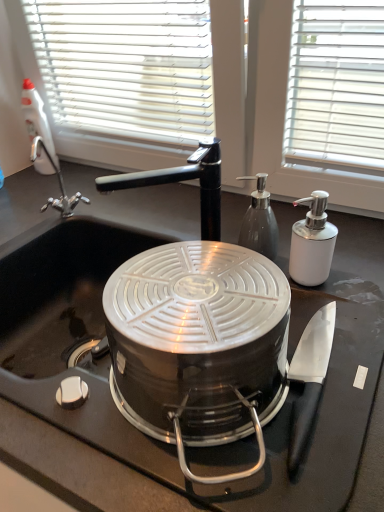
This screenshot has width=384, height=512. Describe the element at coordinates (108, 384) in the screenshot. I see `black matte sink at center` at that location.

What do you see at coordinates (38, 128) in the screenshot? I see `white plastic spray bottle at upper left` at bounding box center [38, 128].

This screenshot has width=384, height=512. Identify the location of white glossy soap dispenser at right, the first kitchen appliance positioned from the right. click(x=312, y=242).

Can we say black matte sink at center lies outside white plastic spray bottle at upper left?

Yes.

From the image's perspective, which is below, black matte sink at center or white plastic spray bottle at upper left?

black matte sink at center is shown below in the image.

Does black matte sink at center have a smaller size compared to white plastic spray bottle at upper left?

No.

What's the angular difference between black matte sink at center and white plastic spray bottle at upper left's facing directions?

The angular difference between black matte sink at center and white plastic spray bottle at upper left is 27.4 degrees.

Is white glossy soap dispenser at right, the first kitchen appliance positioned from the right, positioned with its back to translucent glass soap dispenser at center, the second kitchen appliance viewed from the right?

No, white glossy soap dispenser at right, the first kitchen appliance positioned from the right, is not facing the opposite direction of translucent glass soap dispenser at center, the second kitchen appliance viewed from the right.

From a real-world perspective, is white glossy soap dispenser at right, marked as the second kitchen appliance in a left-to-right arrangement, located higher than translucent glass soap dispenser at center, the 1th kitchen appliance in the left-to-right sequence?

Actually, white glossy soap dispenser at right, marked as the second kitchen appliance in a left-to-right arrangement, is physically below translucent glass soap dispenser at center, the 1th kitchen appliance in the left-to-right sequence, in the real world.

Where is `kitchen appliance on the left side of white glossy soap dispenser at right, marked as the second kitchen appliance in a left-to-right arrangement`? The width and height of the screenshot is (384, 512). kitchen appliance on the left side of white glossy soap dispenser at right, marked as the second kitchen appliance in a left-to-right arrangement is located at coordinates (259, 221).

From a real-world perspective, does white plastic spray bottle at upper left sit lower than translucent glass soap dispenser at center, the second kitchen appliance viewed from the right?

No.

Can you confirm if white plastic spray bottle at upper left is positioned to the left of translucent glass soap dispenser at center, the second kitchen appliance viewed from the right?

Indeed, white plastic spray bottle at upper left is positioned on the left side of translucent glass soap dispenser at center, the second kitchen appliance viewed from the right.

Which is in front, white plastic spray bottle at upper left or translucent glass soap dispenser at center, the 1th kitchen appliance in the left-to-right sequence?

translucent glass soap dispenser at center, the 1th kitchen appliance in the left-to-right sequence, is closer to the camera.

The width and height of the screenshot is (384, 512). In order to click on bottle lying above the translucent glass soap dispenser at center, the 1th kitchen appliance in the left-to-right sequence (from the image's perspective) in this screenshot , I will do `click(38, 128)`.

From the picture: Can you confirm if black matte sink at center is wider than translucent glass soap dispenser at center, the 1th kitchen appliance in the left-to-right sequence?

Yes, black matte sink at center is wider than translucent glass soap dispenser at center, the 1th kitchen appliance in the left-to-right sequence.

Is point (291, 490) more distant than point (252, 228)?

No, (291, 490) is closer to viewer.

This screenshot has height=512, width=384. Identify the location of the 2nd kitchen appliance above when counting from the black matte sink at center (from the image's perspective). click(x=259, y=221).

Does black matte sink at center have a lesser height compared to translucent glass soap dispenser at center, the 1th kitchen appliance in the left-to-right sequence?

In fact, black matte sink at center may be taller than translucent glass soap dispenser at center, the 1th kitchen appliance in the left-to-right sequence.

Which is in front, translucent glass soap dispenser at center, the second kitchen appliance viewed from the right, or white glossy soap dispenser at right, the first kitchen appliance positioned from the right?

Positioned in front is white glossy soap dispenser at right, the first kitchen appliance positioned from the right.

At what (x,y) coordinates should I click in order to perform the action: click on kitchen appliance on the left of white glossy soap dispenser at right, marked as the second kitchen appliance in a left-to-right arrangement. Please return your answer as a coordinate pair (x, y). This screenshot has height=512, width=384. Looking at the image, I should click on (259, 221).

Is translucent glass soap dispenser at center, the second kitchen appliance viewed from the right, to the left of white glossy soap dispenser at right, the first kitchen appliance positioned from the right, from the viewer's perspective?

Yes, translucent glass soap dispenser at center, the second kitchen appliance viewed from the right, is to the left of white glossy soap dispenser at right, the first kitchen appliance positioned from the right.

From a real-world perspective, is translucent glass soap dispenser at center, the 1th kitchen appliance in the left-to-right sequence, physically located above or below white glossy soap dispenser at right, marked as the second kitchen appliance in a left-to-right arrangement?

From a real-world perspective, translucent glass soap dispenser at center, the 1th kitchen appliance in the left-to-right sequence, is physically above white glossy soap dispenser at right, marked as the second kitchen appliance in a left-to-right arrangement.

From the image's perspective, which is below, white plastic spray bottle at upper left or black matte sink at center?

black matte sink at center, from the image's perspective.

What's the angular difference between white plastic spray bottle at upper left and black matte sink at center's facing directions?

The angular difference between white plastic spray bottle at upper left and black matte sink at center is 27.4 degrees.

Is white plastic spray bottle at upper left thinner than black matte sink at center?

Yes.

Based on the photo, is white plastic spray bottle at upper left in contact with black matte sink at center?

They are not placed beside each other.

Does translucent glass soap dispenser at center, the 1th kitchen appliance in the left-to-right sequence, turn towards white plastic spray bottle at upper left?

No.

Does translucent glass soap dispenser at center, the second kitchen appliance viewed from the right, come in front of white plastic spray bottle at upper left?

Yes, translucent glass soap dispenser at center, the second kitchen appliance viewed from the right, is in front of white plastic spray bottle at upper left.

Where is `kitchen appliance that is the 1st one below the white plastic spray bottle at upper left (from a real-world perspective)`? kitchen appliance that is the 1st one below the white plastic spray bottle at upper left (from a real-world perspective) is located at coordinates (259, 221).

Is translucent glass soap dispenser at center, the 1th kitchen appliance in the left-to-right sequence, bigger or smaller than white plastic spray bottle at upper left?

translucent glass soap dispenser at center, the 1th kitchen appliance in the left-to-right sequence, is smaller than white plastic spray bottle at upper left.

Where is `sink that appears on the right of white plastic spray bottle at upper left`? The height and width of the screenshot is (512, 384). sink that appears on the right of white plastic spray bottle at upper left is located at coordinates (108, 384).

Where is `kitchen appliance above the white glossy soap dispenser at right, the first kitchen appliance positioned from the right (from a real-world perspective)`? kitchen appliance above the white glossy soap dispenser at right, the first kitchen appliance positioned from the right (from a real-world perspective) is located at coordinates (259, 221).

From the image, which object appears to be farther from white glossy soap dispenser at right, marked as the second kitchen appliance in a left-to-right arrangement, translucent glass soap dispenser at center, the 1th kitchen appliance in the left-to-right sequence, or black matte sink at center?

black matte sink at center.

Based on their spatial positions, is white glossy soap dispenser at right, the first kitchen appliance positioned from the right, or translucent glass soap dispenser at center, the 1th kitchen appliance in the left-to-right sequence, further from white plastic spray bottle at upper left?

white glossy soap dispenser at right, the first kitchen appliance positioned from the right, is positioned further to the anchor white plastic spray bottle at upper left.

Which object lies nearer to the anchor point white plastic spray bottle at upper left, translucent glass soap dispenser at center, the 1th kitchen appliance in the left-to-right sequence, or black matte sink at center?

Among the two, black matte sink at center is located nearer to white plastic spray bottle at upper left.

Looking at the image, which one is located closer to translucent glass soap dispenser at center, the 1th kitchen appliance in the left-to-right sequence, white plastic spray bottle at upper left or black matte sink at center?

The object closer to translucent glass soap dispenser at center, the 1th kitchen appliance in the left-to-right sequence, is black matte sink at center.

Which object lies further to the anchor point black matte sink at center, translucent glass soap dispenser at center, the 1th kitchen appliance in the left-to-right sequence, or white glossy soap dispenser at right, marked as the second kitchen appliance in a left-to-right arrangement?

Based on the image, white glossy soap dispenser at right, marked as the second kitchen appliance in a left-to-right arrangement, appears to be further to black matte sink at center.

Which object lies further to the anchor point white plastic spray bottle at upper left, black matte sink at center or white glossy soap dispenser at right, the first kitchen appliance positioned from the right?

The object further to white plastic spray bottle at upper left is white glossy soap dispenser at right, the first kitchen appliance positioned from the right.

From the image, which object appears to be nearer to translucent glass soap dispenser at center, the second kitchen appliance viewed from the right, white glossy soap dispenser at right, marked as the second kitchen appliance in a left-to-right arrangement, or white plastic spray bottle at upper left?

white glossy soap dispenser at right, marked as the second kitchen appliance in a left-to-right arrangement.

Which object lies further to the anchor point white glossy soap dispenser at right, marked as the second kitchen appliance in a left-to-right arrangement, white plastic spray bottle at upper left or translucent glass soap dispenser at center, the 1th kitchen appliance in the left-to-right sequence?

white plastic spray bottle at upper left is further to white glossy soap dispenser at right, marked as the second kitchen appliance in a left-to-right arrangement.

Where is `kitchen appliance between translucent glass soap dispenser at center, the second kitchen appliance viewed from the right, and black matte sink at center in the up-down direction`? Image resolution: width=384 pixels, height=512 pixels. kitchen appliance between translucent glass soap dispenser at center, the second kitchen appliance viewed from the right, and black matte sink at center in the up-down direction is located at coordinates (312, 242).

The height and width of the screenshot is (512, 384). I want to click on kitchen appliance between white plastic spray bottle at upper left and white glossy soap dispenser at right, marked as the second kitchen appliance in a left-to-right arrangement, from left to right, so click(x=259, y=221).